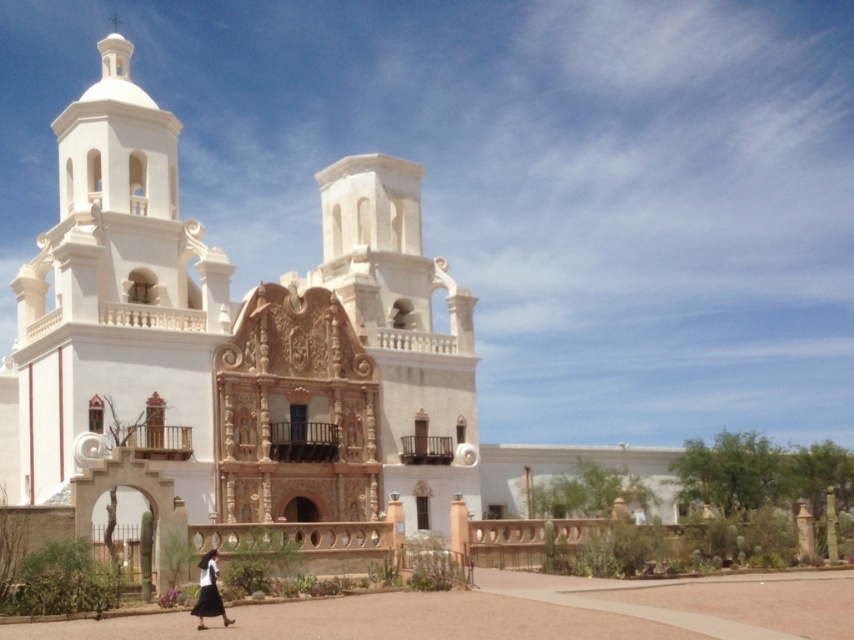
Question: Is white stucco church at center bigger than white cotton dress at lower center?

Choices:
 (A) yes
 (B) no

Answer: (A)

Question: Considering the relative positions of white stucco church at center and white cotton dress at lower center in the image provided, where is white stucco church at center located with respect to white cotton dress at lower center?

Choices:
 (A) right
 (B) left

Answer: (B)

Question: Is white stucco church at center closer to camera compared to white cotton dress at lower center?

Choices:
 (A) yes
 (B) no

Answer: (B)

Question: Which point is farther to the camera?

Choices:
 (A) (203, 627)
 (B) (174, 227)

Answer: (B)

Question: Which point is closer to the camera taking this photo?

Choices:
 (A) click(x=437, y=369)
 (B) click(x=199, y=561)

Answer: (B)